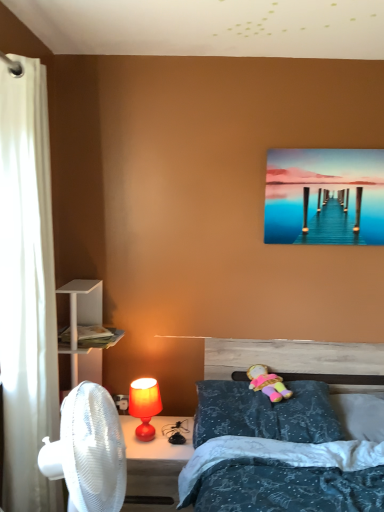
Locate an element on the screen. The height and width of the screenshot is (512, 384). vacant space situated above matte red lamp at lower center (from a real-world perspective) is located at coordinates (140, 436).